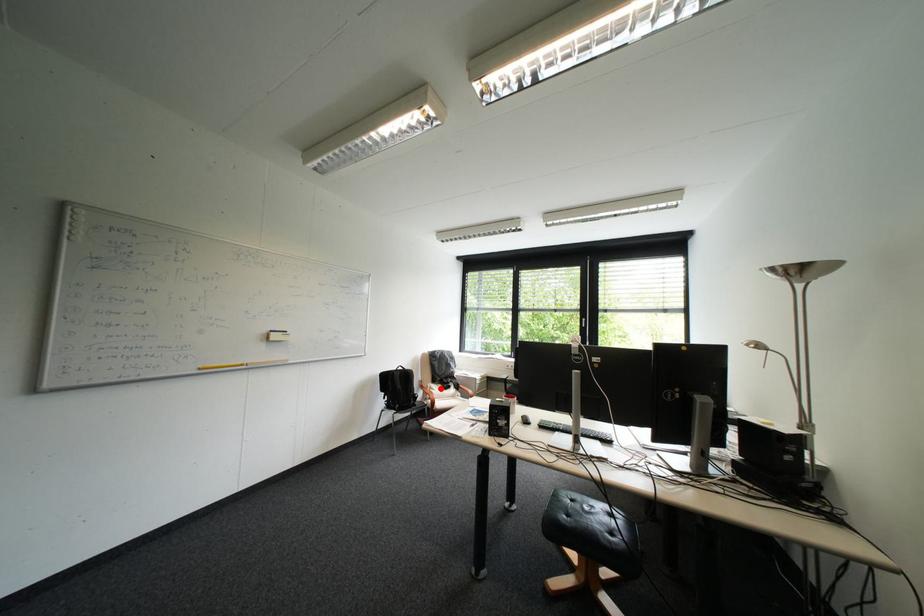
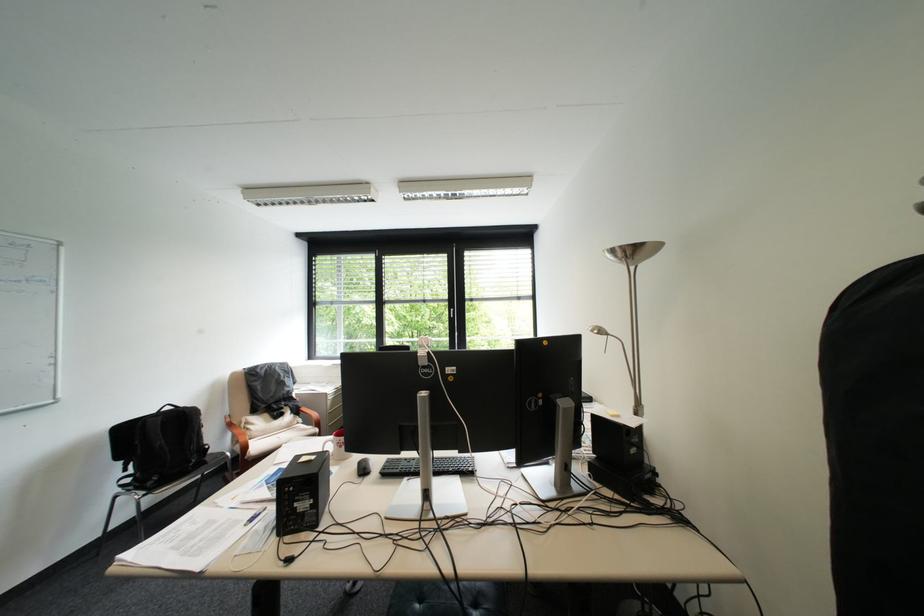
The point at the highlighted location is marked in the first image. Where is the corresponding point in the second image?

(256, 424)